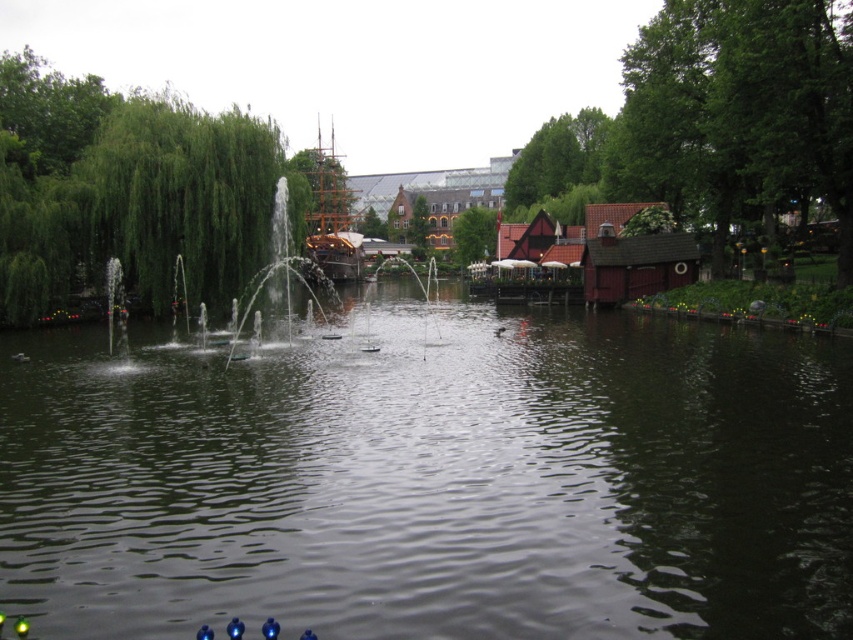
Question: Based on their relative distances, which object is farther from the green wood tree at right?

Choices:
 (A) dark green water at center
 (B) green leafy tree at left
 (C) wooden ship at center
 (D) green leafy tree at center

Answer: (C)

Question: Among these points, which one is nearest to the camera?

Choices:
 (A) (608, 390)
 (B) (350, 272)
 (C) (469, 244)
 (D) (729, 134)

Answer: (A)

Question: Does dark green water at center appear over green leafy tree at center?

Choices:
 (A) no
 (B) yes

Answer: (A)

Question: Is green wood tree at right to the left of wooden ship at center from the viewer's perspective?

Choices:
 (A) yes
 (B) no

Answer: (B)

Question: Which point is closer to the camera?

Choices:
 (A) green wood tree at right
 (B) green leafy tree at left
 (C) wooden ship at center
 (D) green leafy tree at center

Answer: (A)

Question: Is dark green water at center smaller than green leafy tree at center?

Choices:
 (A) yes
 (B) no

Answer: (A)